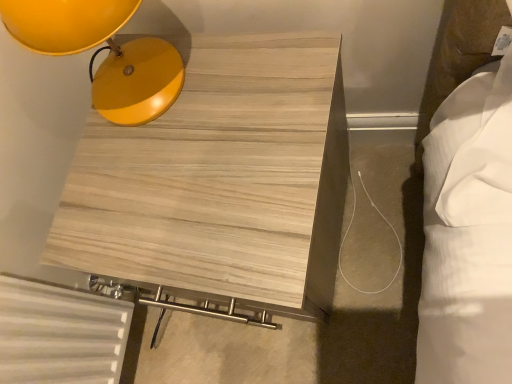
Locate an element on the screen. vacant space underneath matte yellow lampshade at upper left (from a real-world perspective) is located at coordinates (151, 91).